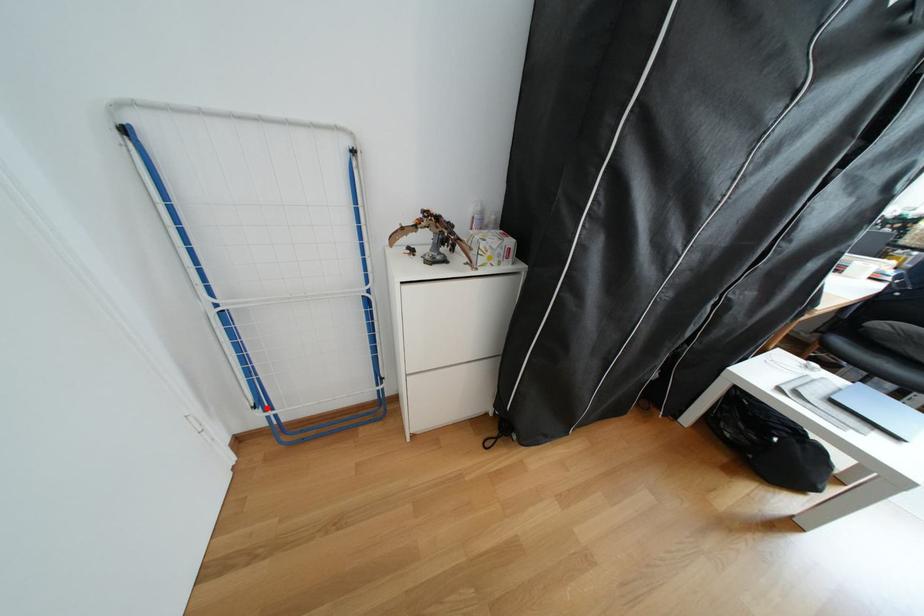
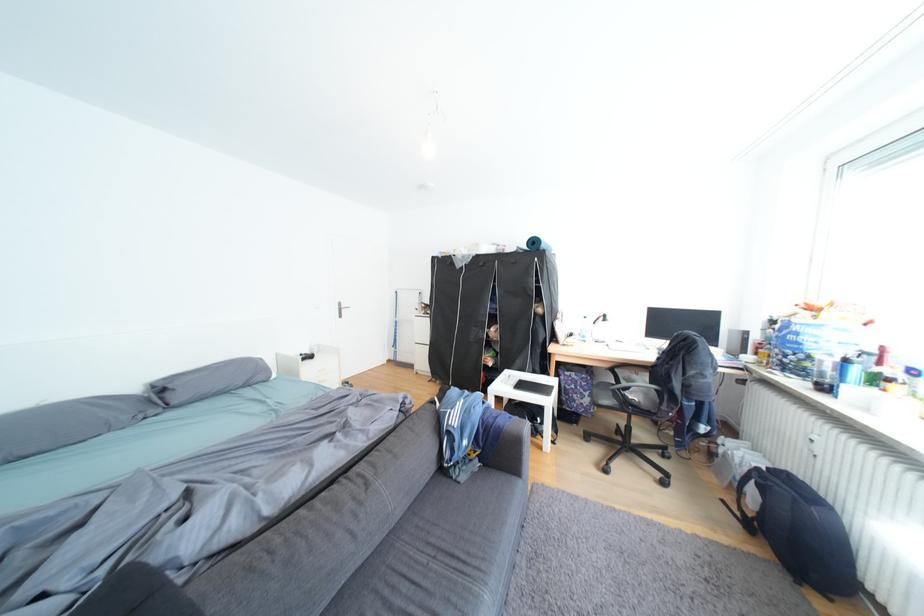
Question: I am providing you with two images of the same scene from different viewpoints. A red point is marked on the first image. Can you still see the location of the red point in image 2?

Choices:
 (A) Yes
 (B) No

Answer: (B)